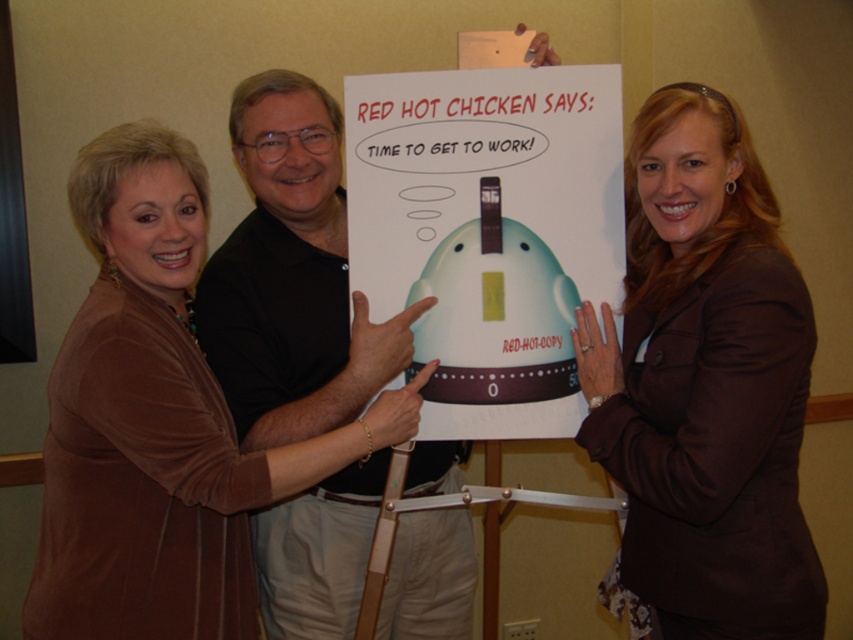
Question: Is brown fabric jacket at upper right smaller than brown velvety sweater at upper left?

Choices:
 (A) no
 (B) yes

Answer: (B)

Question: Does brown velvety sweater at upper left have a lesser width compared to white paperboard at center?

Choices:
 (A) no
 (B) yes

Answer: (A)

Question: Is brown velvety sweater at upper left above white paperboard at center?

Choices:
 (A) yes
 (B) no

Answer: (B)

Question: Among these points, which one is farthest from the camera?

Choices:
 (A) (428, 346)
 (B) (622, 564)

Answer: (A)

Question: Which point is closer to the camera?

Choices:
 (A) (502, 144)
 (B) (44, 593)
 (C) (755, 204)

Answer: (B)

Question: Which point appears closest to the camera in this image?

Choices:
 (A) (764, 221)
 (B) (404, 262)

Answer: (A)